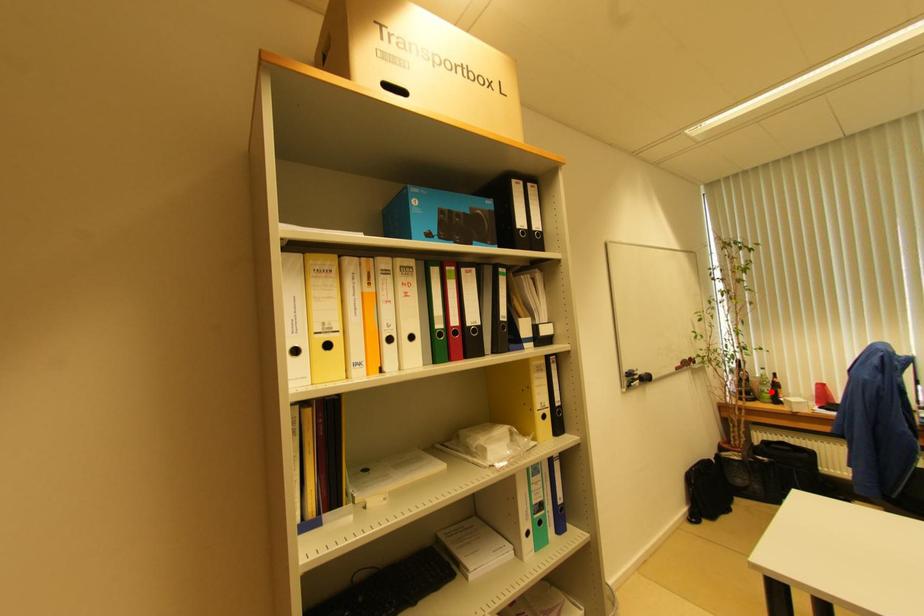
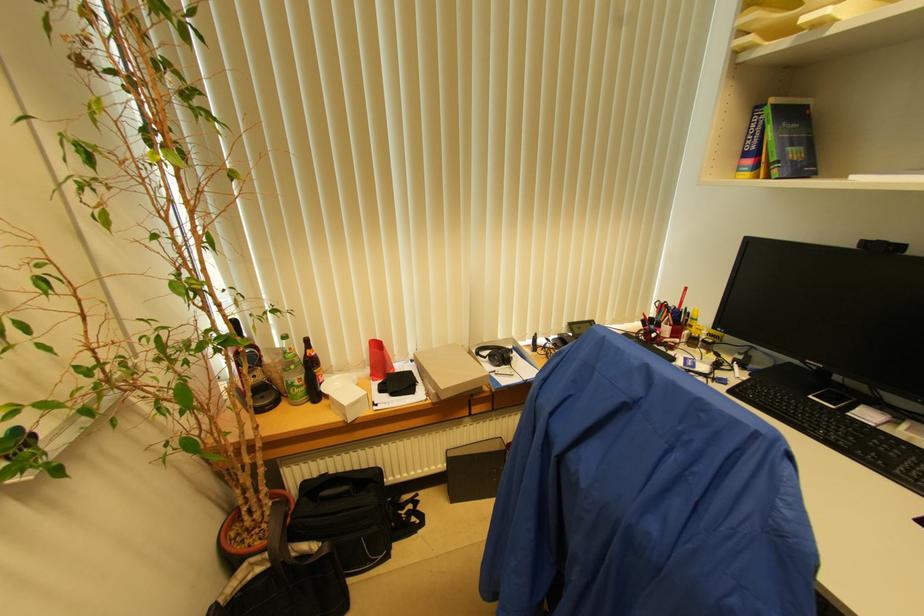
Where in the second image is the point corresponding to the highlighted location from the first image?

(304, 379)